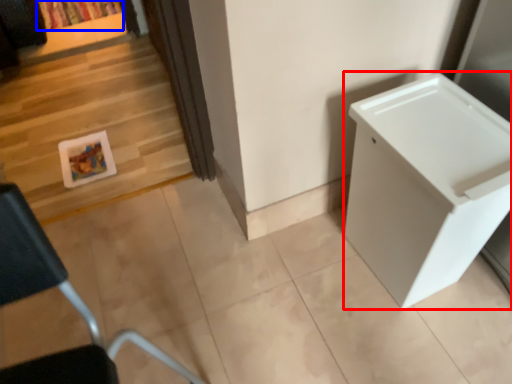
Question: Which of the following is the closest to the observer, changing table (highlighted by a red box) or curtain (highlighted by a blue box)?

Choices:
 (A) changing table
 (B) curtain

Answer: (A)